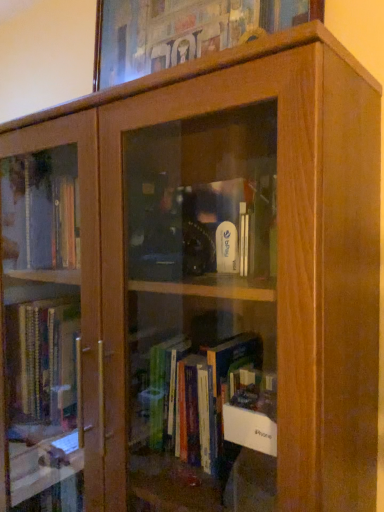
What do you see at coordinates (183, 31) in the screenshot?
I see `wooden picture frame at upper center` at bounding box center [183, 31].

Identify the location of wooden picture frame at upper center. This screenshot has width=384, height=512. (183, 31).

The image size is (384, 512). In order to click on wooden picture frame at upper center in this screenshot , I will do `click(183, 31)`.